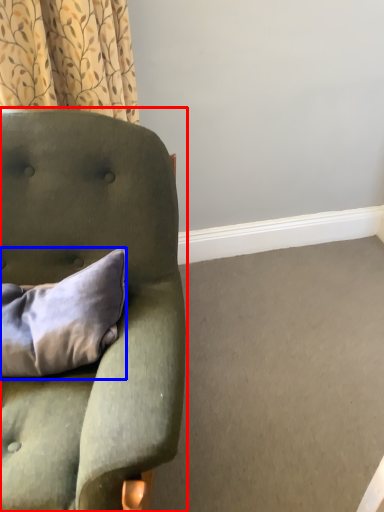
Question: Which point is closer to the camera, chair (highlighted by a red box) or pillow (highlighted by a blue box)?

Choices:
 (A) chair
 (B) pillow

Answer: (A)